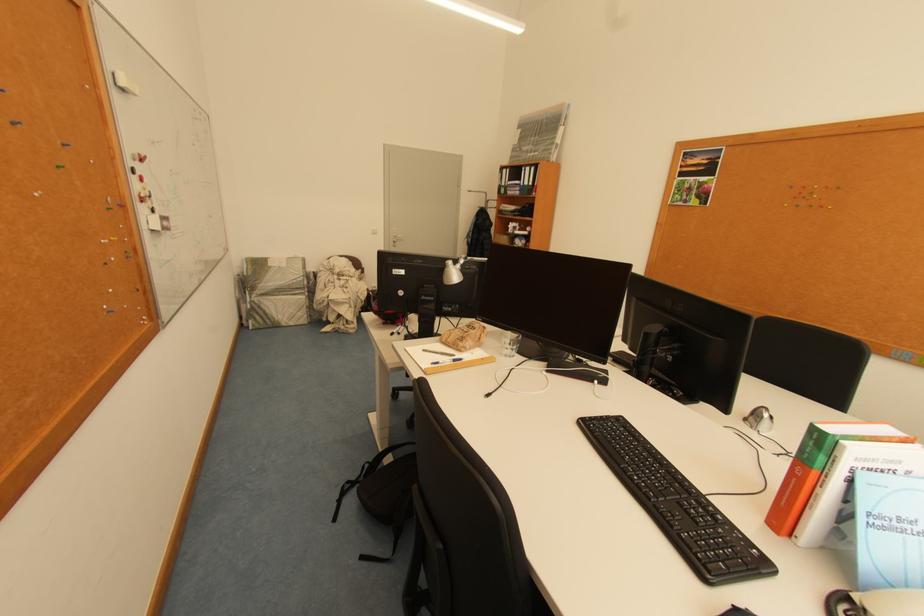
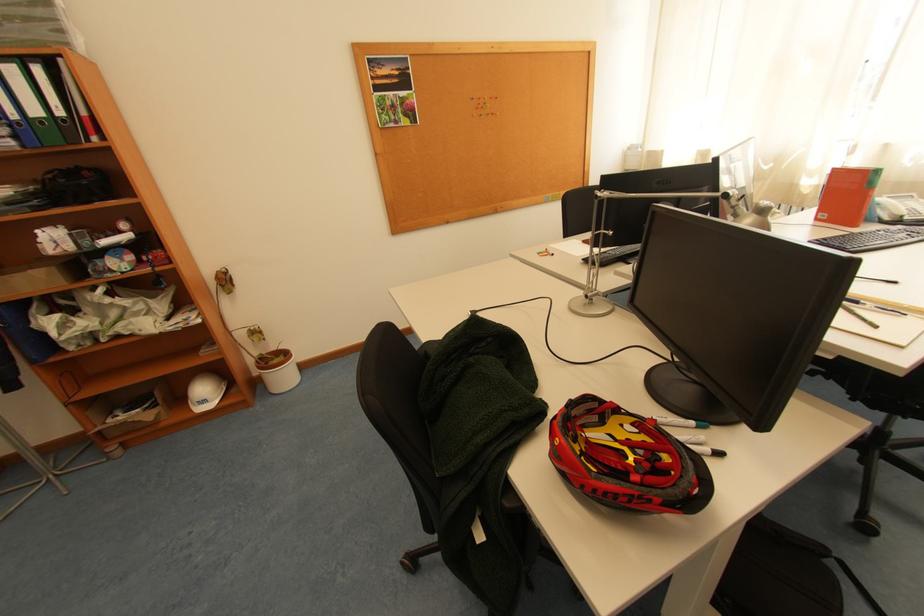
In the second image, find the point that corresponds to pixel 533 185 in the first image.

(44, 113)